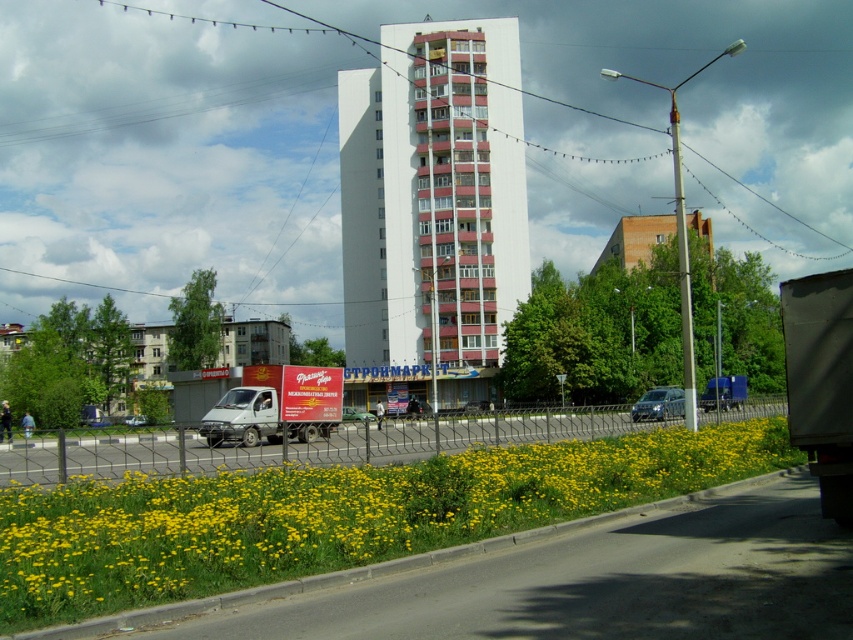
You are standing at the point with coordinates (x=244, y=417) in the urban scene. What object are you standing on?

You are standing on the white matte truck at center.

You are standing at the origin point of the coordinate system. Which direction should you face to look directly at the white smooth building at center?

The white smooth building at center is located at point (432, 209), so you should face northeast to look directly at it.

You are a delivery person trying to park your truck in a space that can only accommodate vehicles up to the width of the white smooth building at center. Can your white matte truck at center fit into this space?

The white smooth building at center might be wider than white matte truck at center, so there is a possibility that the truck can fit, but it depends on the exact width difference. Please verify the measurements before attempting to park.